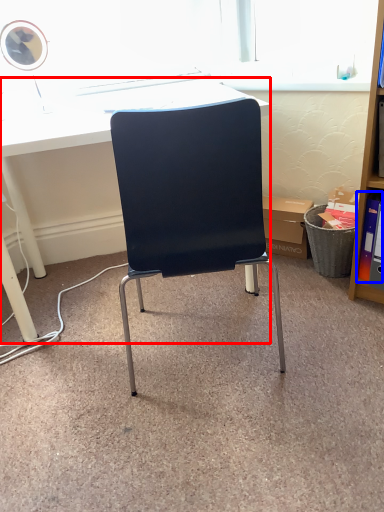
Question: Which object is closer to the camera taking this photo, desk (highlighted by a red box) or book (highlighted by a blue box)?

Choices:
 (A) desk
 (B) book

Answer: (A)